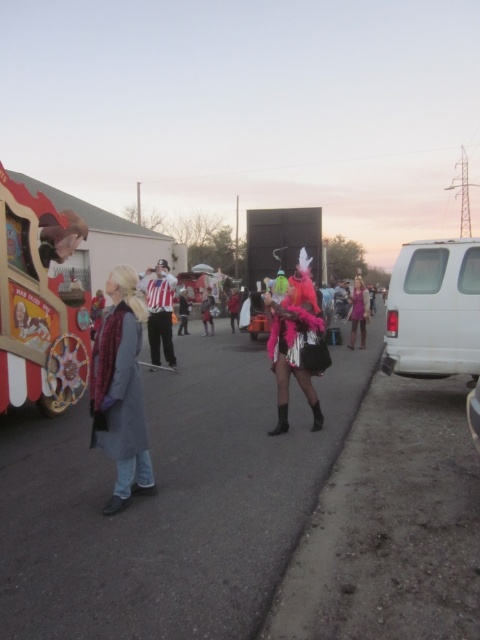
You are a pedestrian trying to reach the denim jacket at lower left. There is a wooden painted food truck at left in your way. Can you walk around it easily?

The wooden painted food truck at left is above the denim jacket at lower left, meaning it is positioned higher up and possibly blocking direct access. However, since the jacket is at lower left, you might need to navigate around the truck from the sides or behind, depending on the surrounding space. Without additional details on the truck size or path width, it is uncertain if walking around would be easy.

You are a photographer trying to capture a candid shot of the purple satin dress at center without including the striped fabric shirt at center in the frame. Is this possible based on their positions?

The striped fabric shirt at center is in front of the purple satin dress at center, so it would block the view. Therefore, it is not possible to capture the purple satin dress at center without including the striped fabric shirt at center in the frame.

You are a photographer trying to capture a group photo of the people in the striped fabric shirt at center and the purple satin dress at center. If you want to ensure both subjects are fully visible in the frame, should you adjust the camera to a wider angle or a narrower angle?

The striped fabric shirt at center might be wider than purple satin dress at center, so to ensure both are fully visible, you should adjust the camera to a wider angle to accommodate the potentially wider subject.